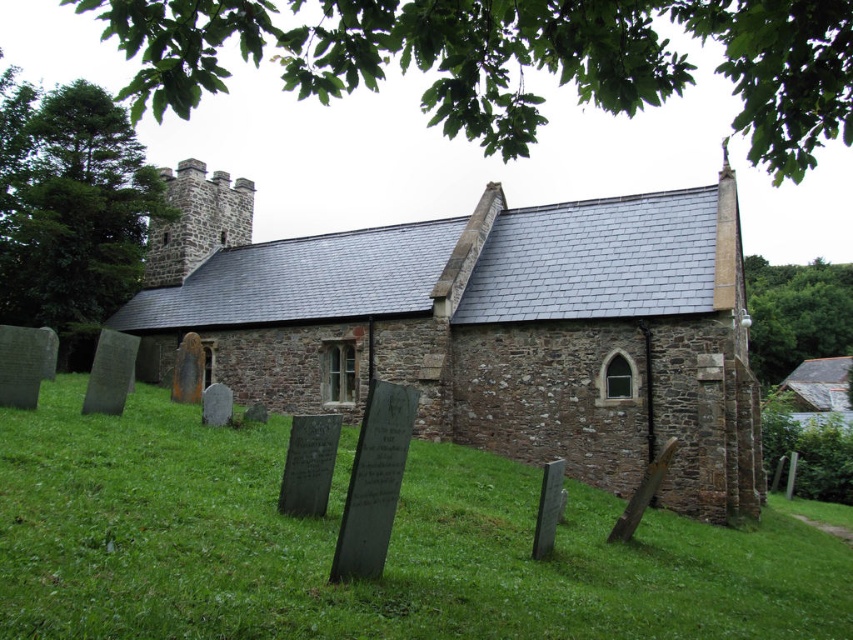
You are standing at the edge of the grassy area near the green stone gravestones at lower left and want to take a photo of the brown stone church at center. Since the gravestones are in the way, can you move them to get a clear shot?

The green stone gravestones at lower left are positioned under the brown stone church at center, so you cannot move them as they are located beneath the church structure.

You are a visitor standing at the edge of the grassy area near the green stone gravestones at lower left. You want to walk straight towards the brown stone church at center. Will you have enough space to walk directly between them without needing to detour around any obstacles?

The green stone gravestones at lower left are smaller in size compared to the brown stone church at center, but the description does not provide specific measurements of the distance between them. Therefore, it is unclear if there is sufficient space to walk directly between them without detouring around obstacles.